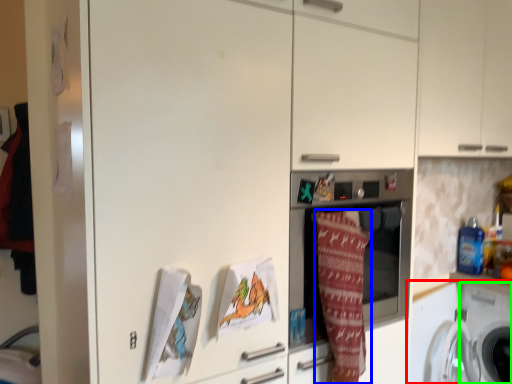
Question: Based on their relative distances, which object is farther from washing machine (highlighted by a red box)? Choose from blanket (highlighted by a blue box) and washing machine (highlighted by a green box).

Choices:
 (A) blanket
 (B) washing machine

Answer: (A)